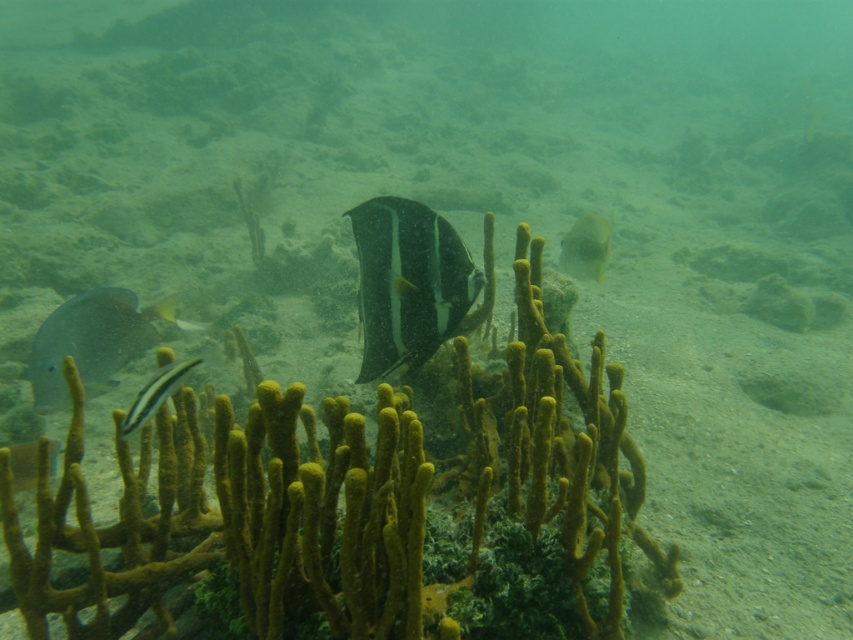
Question: Does black glossy fish at center have a greater width compared to shiny silver fish at lower left?

Choices:
 (A) yes
 (B) no

Answer: (B)

Question: Estimate the real-world distances between objects in this image. Which object is closer to the yellow matte fish at center?

Choices:
 (A) black glossy fish at center
 (B) yellow soft coral at center

Answer: (A)

Question: Is black glossy fish at center smaller than shiny silver fish at lower left?

Choices:
 (A) yes
 (B) no

Answer: (A)

Question: Which point is closer to the camera?

Choices:
 (A) (248, 456)
 (B) (183, 360)
 (C) (583, 234)

Answer: (A)

Question: Which object is positioned closest to the shiny silver fish at lower left?

Choices:
 (A) yellow matte fish at center
 (B) yellow soft coral at center
 (C) shiny silver fish at center
 (D) black glossy fish at center

Answer: (B)

Question: Observing the image, what is the correct spatial positioning of yellow soft coral at center in reference to black glossy fish at center?

Choices:
 (A) left
 (B) right

Answer: (B)